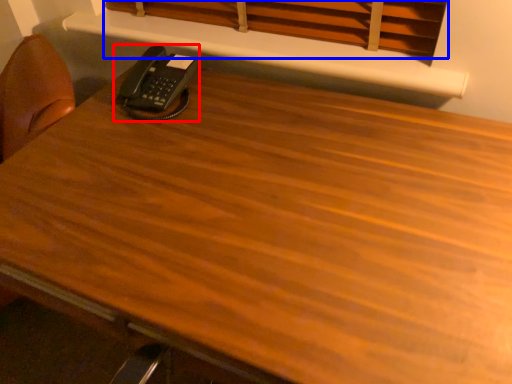
Question: Among these objects, which one is nearest to the camera, corded phone (highlighted by a red box) or curtain (highlighted by a blue box)?

Choices:
 (A) corded phone
 (B) curtain

Answer: (B)